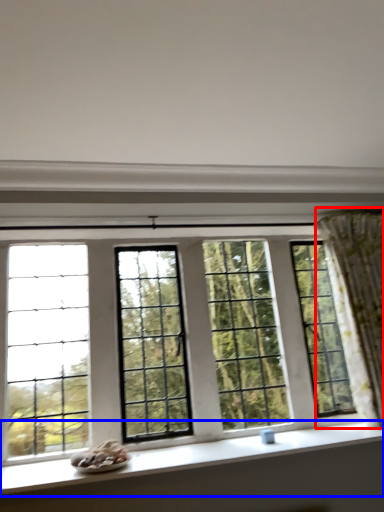
Question: Which point is further to the camera, curtain (highlighted by a red box) or window sill (highlighted by a blue box)?

Choices:
 (A) curtain
 (B) window sill

Answer: (A)